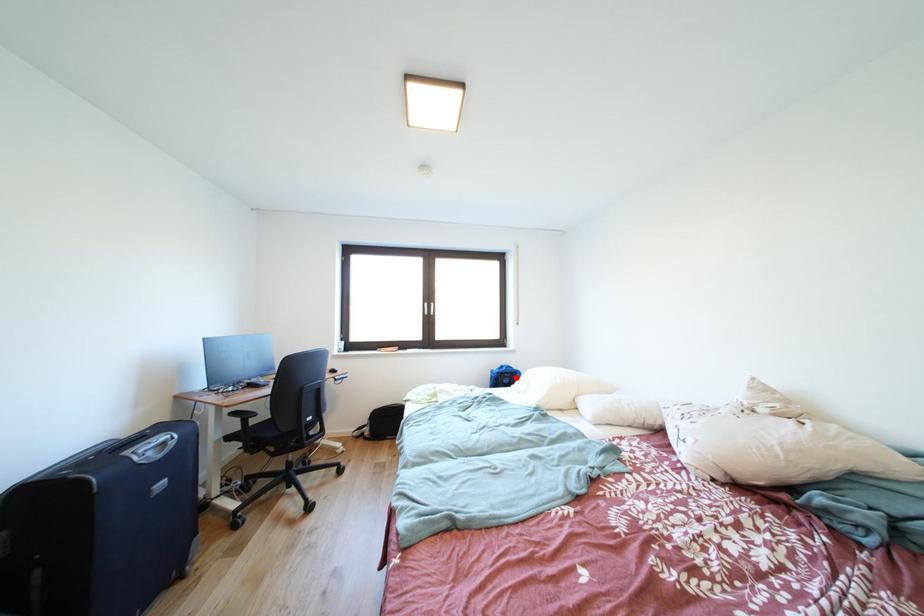
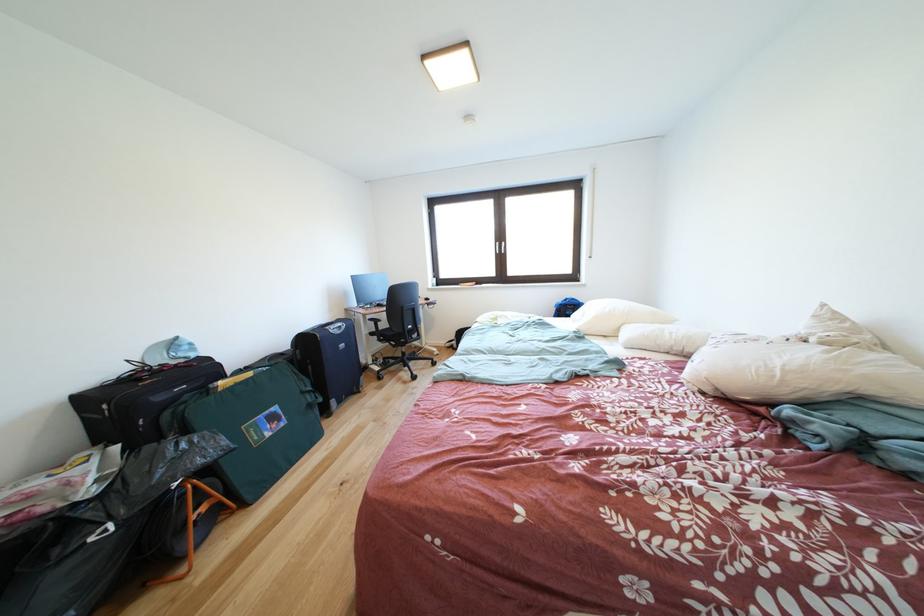
Where in the second image is the point corresponding to the highlighted location from the first image?

(578, 310)